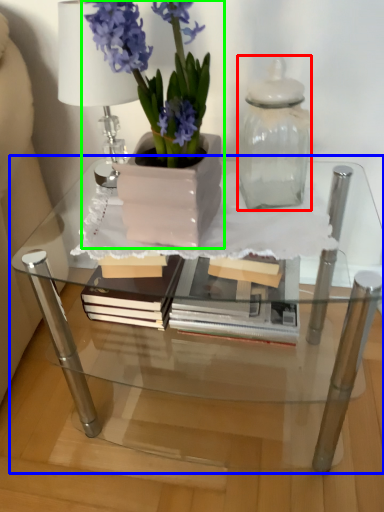
Question: Estimate the real-world distances between objects in this image. Which object is farther from glass vase (highlighted by a red box), table (highlighted by a blue box) or houseplant (highlighted by a green box)?

Choices:
 (A) table
 (B) houseplant

Answer: (A)